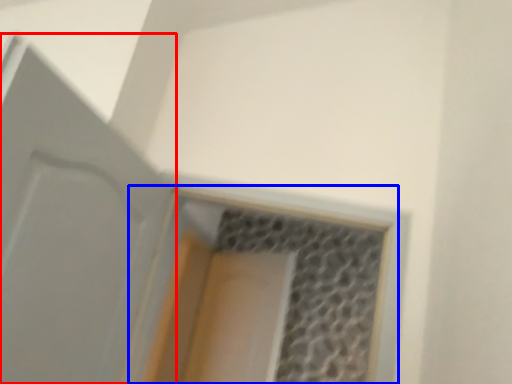
Question: Which object is further to the camera taking this photo, door (highlighted by a red box) or window (highlighted by a blue box)?

Choices:
 (A) door
 (B) window

Answer: (B)